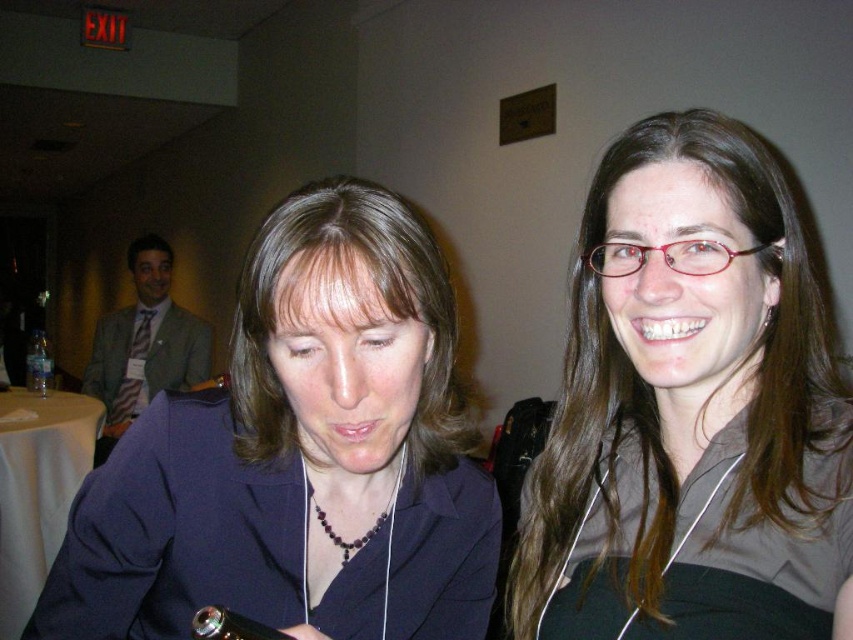
Which is more to the right, matte gray shirt at upper right or matte blue blazer at center?

Positioned to the right is matte gray shirt at upper right.

Who is more distant from viewer, [704,154] or [154,465]?

Point [154,465]

Does point (705, 316) lie in front of point (236, 529)?

Yes, it is.

This screenshot has height=640, width=853. I want to click on matte gray shirt at upper right, so click(x=691, y=410).

Is point (709, 131) positioned behind point (47, 376)?

No, it is in front of (47, 376).

The width and height of the screenshot is (853, 640). What are the coordinates of `matte gray shirt at upper right` in the screenshot? It's located at (691, 410).

Does matte gray shirt at upper right appear over dark purple beaded necklace at center?

Correct, matte gray shirt at upper right is located above dark purple beaded necklace at center.

Is matte gray shirt at upper right below dark purple beaded necklace at center?

Actually, matte gray shirt at upper right is above dark purple beaded necklace at center.

Which is in front, point (596, 198) or point (331, 538)?

Point (596, 198)

At what (x,y) coordinates should I click in order to perform the action: click on matte gray shirt at upper right. Please return your answer as a coordinate pair (x, y). The image size is (853, 640). Looking at the image, I should click on (691, 410).